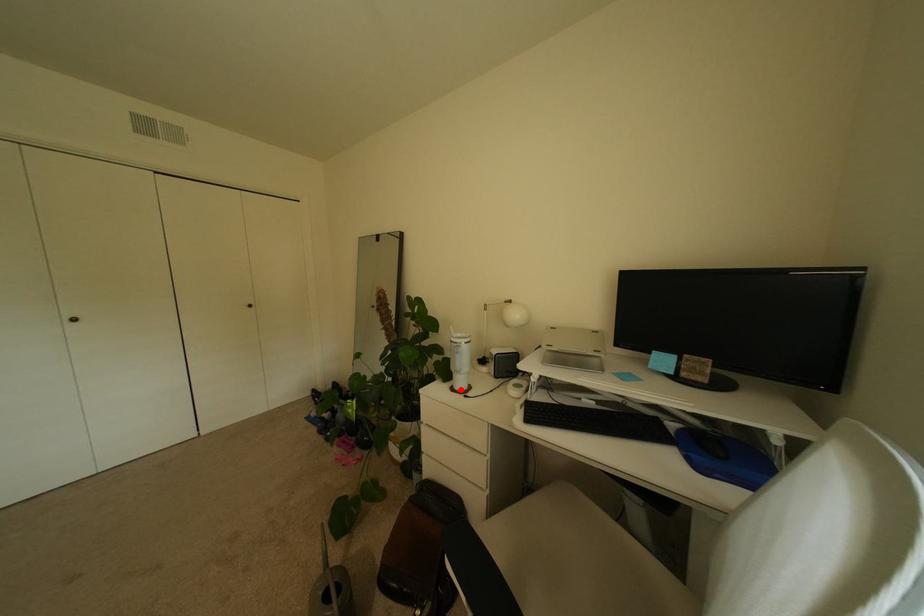
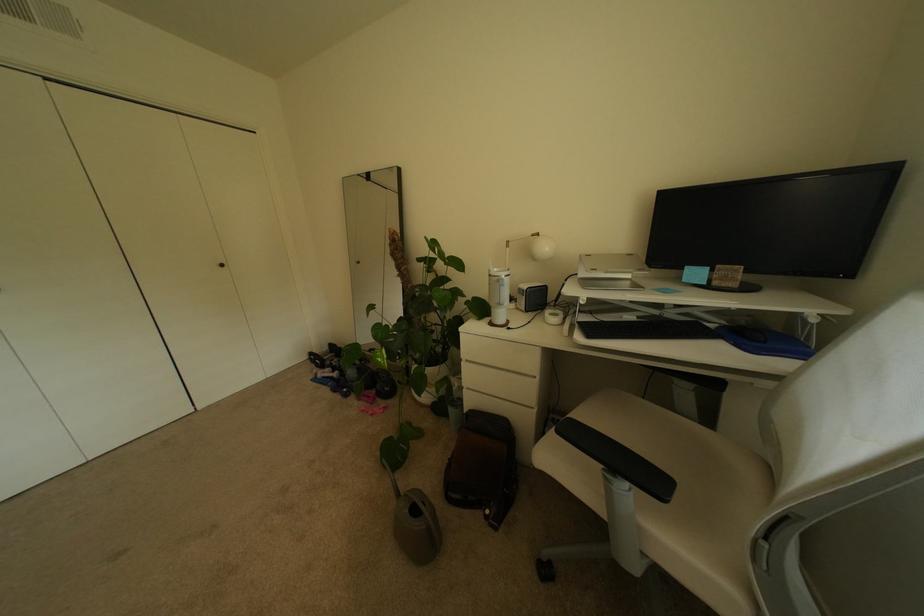
The point at the highlighted location is marked in the first image. Where is the corresponding point in the second image?

(500, 325)